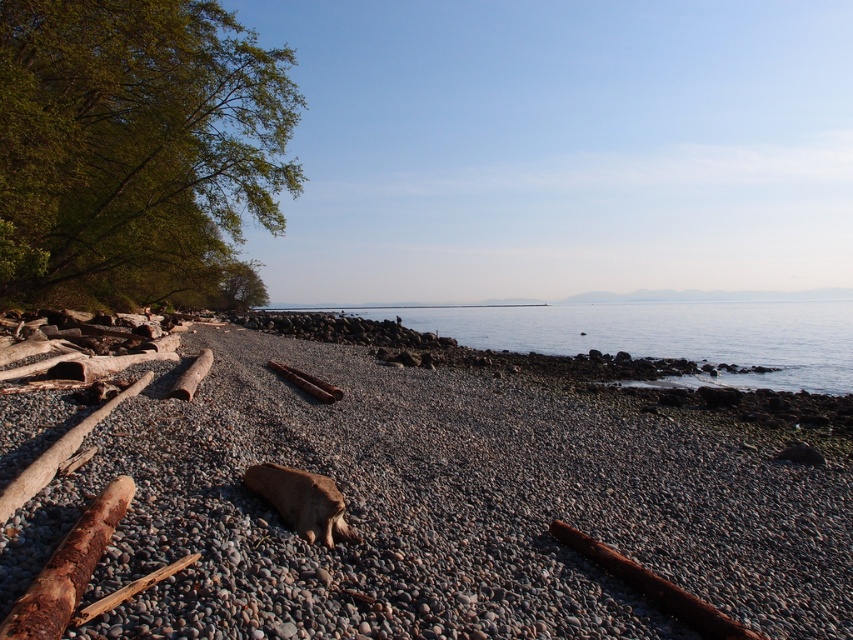
Question: Is the position of green leafy tree at upper left less distant than that of clear water at center?

Choices:
 (A) no
 (B) yes

Answer: (B)

Question: Is smooth pebbles at center above brown rough log at lower left?

Choices:
 (A) no
 (B) yes

Answer: (A)

Question: Considering the real-world distances, which object is closest to the brown rough log at lower left?

Choices:
 (A) smooth pebbles at center
 (B) clear water at center
 (C) green matte tree at upper left

Answer: (A)

Question: Can you confirm if green leafy tree at upper left is wider than clear water at center?

Choices:
 (A) no
 (B) yes

Answer: (A)

Question: Which object appears farthest from the camera in this image?

Choices:
 (A) green matte tree at upper left
 (B) brown rough log at lower left
 (C) clear water at center
 (D) green leafy tree at upper left

Answer: (A)

Question: Among these points, which one is farthest from the camera?

Choices:
 (A) (51, 596)
 (B) (221, 276)
 (C) (132, 106)
 (D) (665, 308)

Answer: (D)